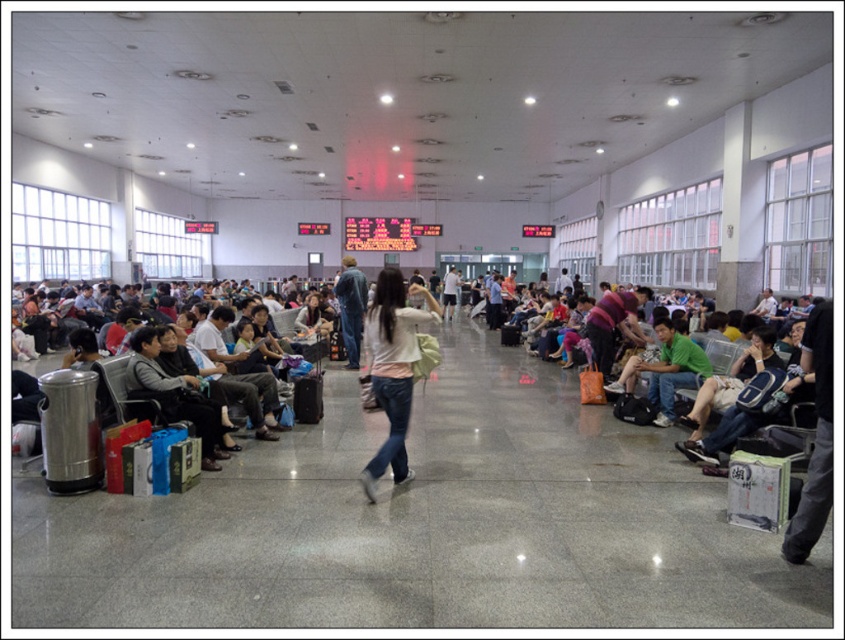
Is point (391, 307) positioned after point (303, 408)?

No.

In the scene shown: Which of these two, white matte shirt at center or black fabric suitcase at center, stands shorter?

black fabric suitcase at center is shorter.

Between point (372, 490) and point (315, 385), which one is positioned in front?

Positioned in front is point (372, 490).

Identify the location of white matte shirt at center. 391,369.